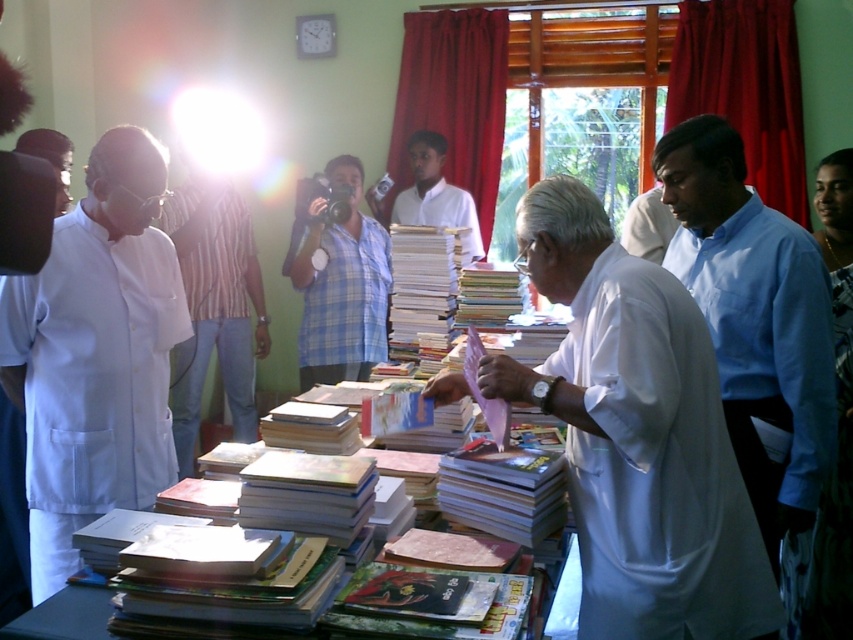
Can you confirm if blue plaid shirt at center is smaller than white cloth at left?

Actually, blue plaid shirt at center might be larger than white cloth at left.

Is blue plaid shirt at center wider than white cloth at left?

Yes.

The height and width of the screenshot is (640, 853). Find the location of `blue plaid shirt at center`. blue plaid shirt at center is located at coordinates (340, 285).

Where is `blue plaid shirt at center`? blue plaid shirt at center is located at coordinates (340, 285).

Is blue shirt at right shorter than white matte shirt at center?

No.

Between blue shirt at right and white matte shirt at center, which one appears on the right side from the viewer's perspective?

Positioned to the right is blue shirt at right.

Is point (790, 228) farther from camera compared to point (434, 220)?

No.

At what (x,y) coordinates should I click in order to perform the action: click on blue shirt at right. Please return your answer as a coordinate pair (x, y). Looking at the image, I should click on (753, 317).

Measure the distance between point (292, 268) and camera.

Point (292, 268) and camera are 3.78 meters apart from each other.

Is blue plaid shirt at center thinner than wooden table at center?

In fact, blue plaid shirt at center might be wider than wooden table at center.

Identify the location of blue plaid shirt at center. (340, 285).